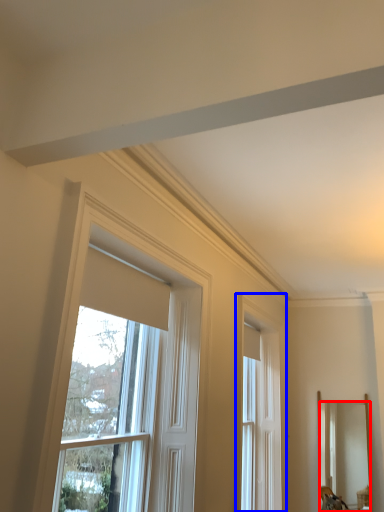
Question: Which of the following is the closest to the observer, mirror (highlighted by a red box) or window (highlighted by a blue box)?

Choices:
 (A) mirror
 (B) window

Answer: (B)